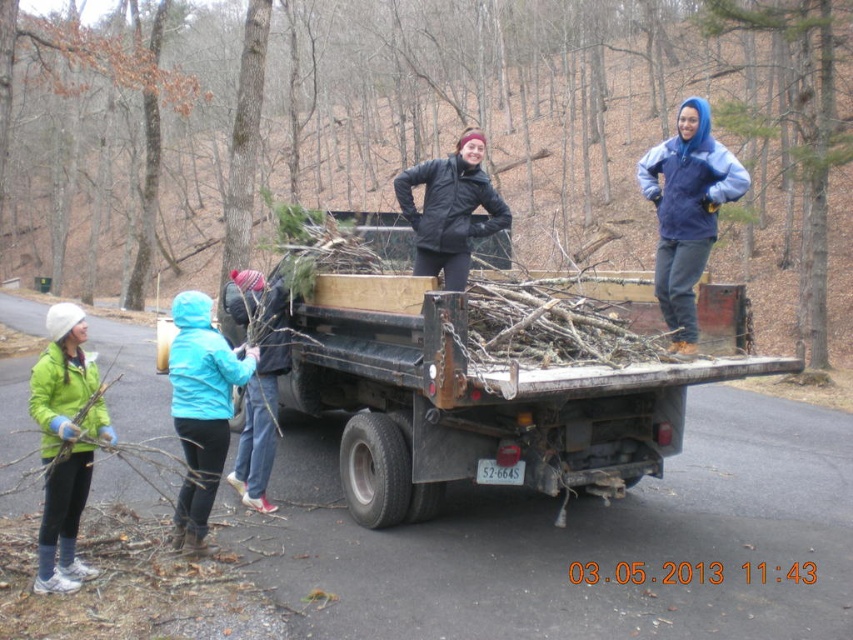
Consider the image. Can you confirm if blue fleece jacket at lower left is wider than black matte jacket at center?

Correct, the width of blue fleece jacket at lower left exceeds that of black matte jacket at center.

What do you see at coordinates (201, 408) in the screenshot? I see `blue fleece jacket at lower left` at bounding box center [201, 408].

Find the location of a particular element. blue fleece jacket at lower left is located at coordinates (201, 408).

Between blue fleece jacket at upper right and blue fleece jacket at center, which one is positioned higher?

blue fleece jacket at upper right

Is blue fleece jacket at upper right in front of blue fleece jacket at center?

That is True.

Which is behind, point (706, 195) or point (270, 387)?

Positioned behind is point (270, 387).

Find the location of a particular element. The image size is (853, 640). blue fleece jacket at upper right is located at coordinates (688, 212).

Does brown rough wood at center appear on the right side of rusty metal truck at center?

Incorrect, brown rough wood at center is not on the right side of rusty metal truck at center.

This screenshot has width=853, height=640. Describe the element at coordinates (577, 116) in the screenshot. I see `brown rough wood at center` at that location.

Where is `brown rough wood at center`? brown rough wood at center is located at coordinates (577, 116).